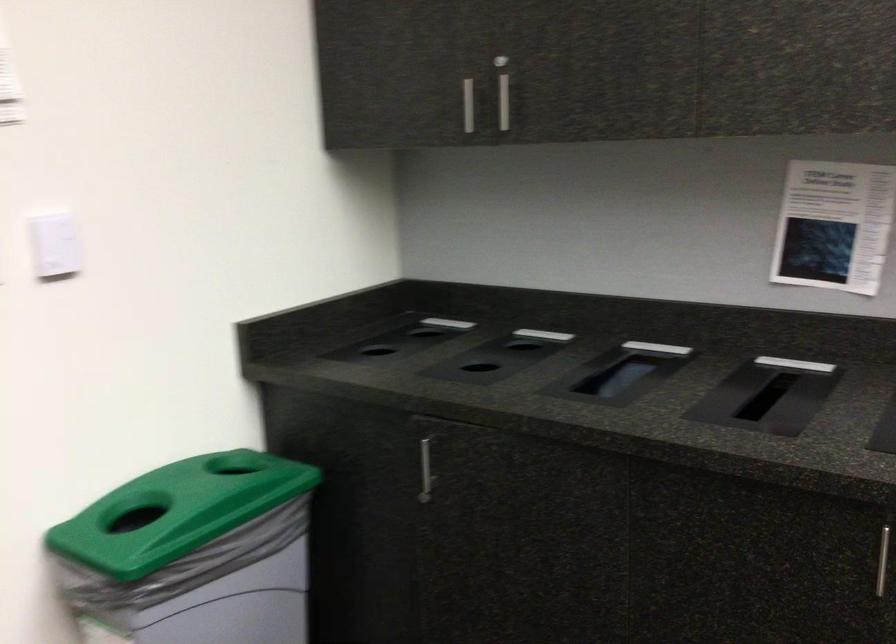
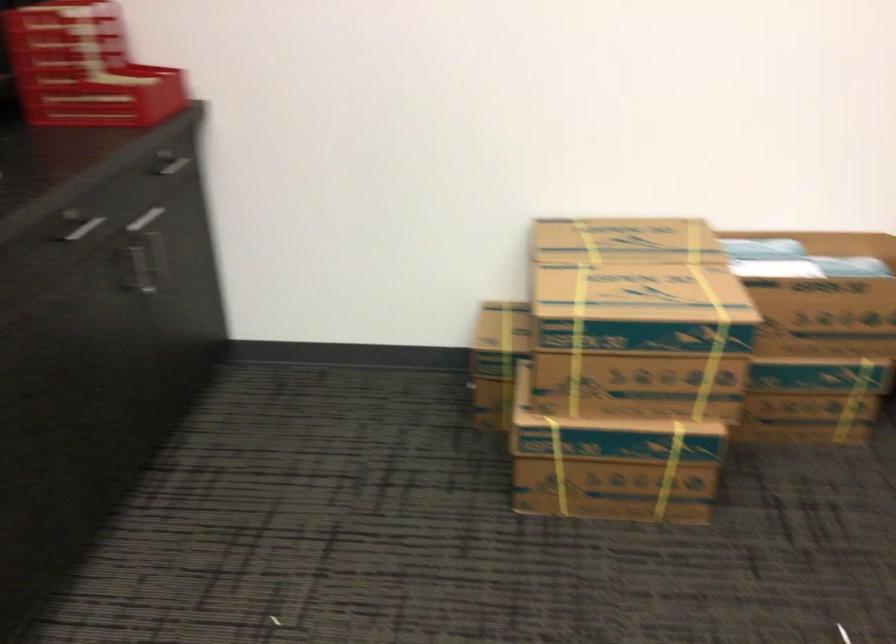
The first image is from the beginning of the video and the second image is from the end. How did the camera likely rotate when shooting the video?

The camera's rotation is toward right-down.